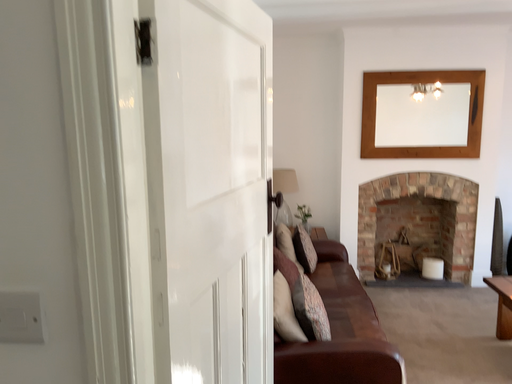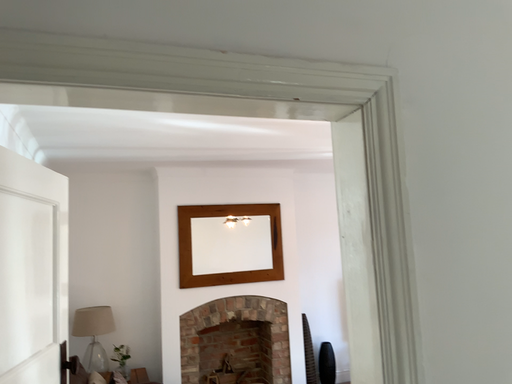
Question: Which way did the camera rotate in the video?

Choices:
 (A) rotated downward
 (B) rotated upward

Answer: (B)